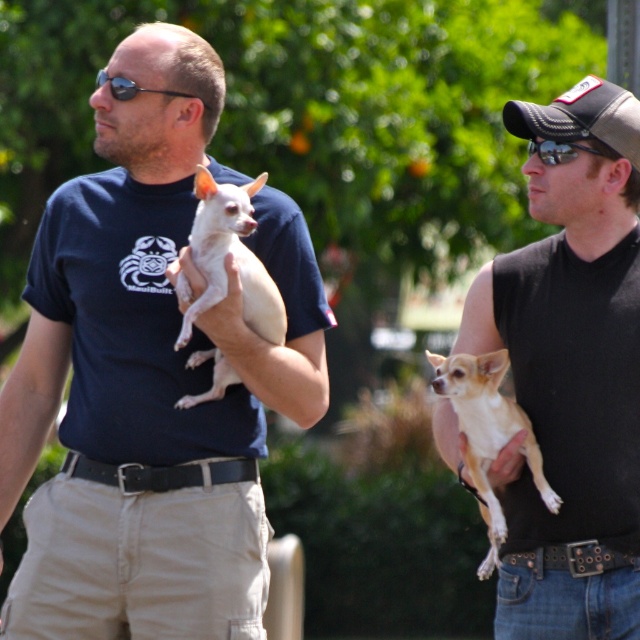
You are standing in the middle of the scene and want to walk towards the point that is closer to you. Which point should you walk towards, point (605, 456) or point (497, 374)?

Point (605, 456) is in front of point (497, 374), so you should walk towards point (605, 456) because it is closer to you.

You are standing at the origin point in the image. Which of the two points, point [196,113] or point [497,545], is located behind the other?

Point [196,113] is behind point [497,545].